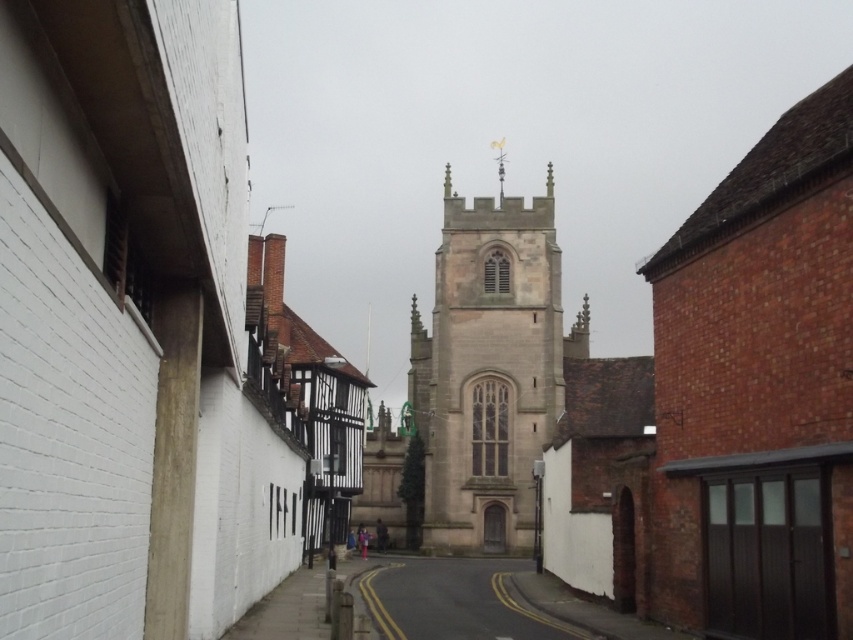
Question: Can you confirm if light brown stone tower at center is wider than smooth asphalt road at center?

Choices:
 (A) yes
 (B) no

Answer: (A)

Question: From the image, what is the correct spatial relationship of light brown stone tower at center in relation to smooth asphalt road at center?

Choices:
 (A) left
 (B) right

Answer: (B)

Question: Which point appears closest to the camera in this image?

Choices:
 (A) (546, 236)
 (B) (445, 634)

Answer: (B)

Question: Which point is closer to the camera?

Choices:
 (A) (434, 444)
 (B) (373, 570)

Answer: (B)

Question: Does light brown stone tower at center have a larger size compared to smooth asphalt road at center?

Choices:
 (A) yes
 (B) no

Answer: (A)